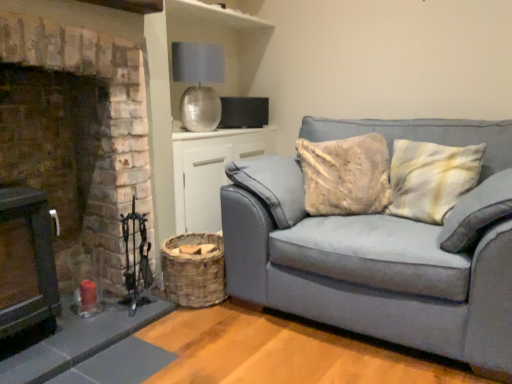
Question: Is brick fireplace at left smaller than woven wood basket at lower center?

Choices:
 (A) yes
 (B) no

Answer: (B)

Question: From the image's perspective, is brick fireplace at left above woven wood basket at lower center?

Choices:
 (A) yes
 (B) no

Answer: (A)

Question: Does brick fireplace at left have a lesser width compared to woven wood basket at lower center?

Choices:
 (A) yes
 (B) no

Answer: (B)

Question: Does brick fireplace at left turn towards woven wood basket at lower center?

Choices:
 (A) yes
 (B) no

Answer: (B)

Question: Would you say brick fireplace at left contains woven wood basket at lower center?

Choices:
 (A) no
 (B) yes

Answer: (A)

Question: From a real-world perspective, is brick fireplace at left under woven wood basket at lower center?

Choices:
 (A) no
 (B) yes

Answer: (A)

Question: Is the position of metallic silver lampshade at upper center less distant than that of brick fireplace at left?

Choices:
 (A) yes
 (B) no

Answer: (B)

Question: Is metallic silver lampshade at upper center not inside brick fireplace at left?

Choices:
 (A) no
 (B) yes

Answer: (B)

Question: From a real-world perspective, does metallic silver lampshade at upper center stand above brick fireplace at left?

Choices:
 (A) no
 (B) yes

Answer: (B)

Question: Is brick fireplace at left a part of metallic silver lampshade at upper center?

Choices:
 (A) yes
 (B) no

Answer: (B)

Question: From the image's perspective, is metallic silver lampshade at upper center on top of brick fireplace at left?

Choices:
 (A) yes
 (B) no

Answer: (A)

Question: Is metallic silver lampshade at upper center at the left side of brick fireplace at left?

Choices:
 (A) yes
 (B) no

Answer: (B)

Question: Can metallic silver lampshade at upper center be found inside brick fireplace at left?

Choices:
 (A) no
 (B) yes

Answer: (A)